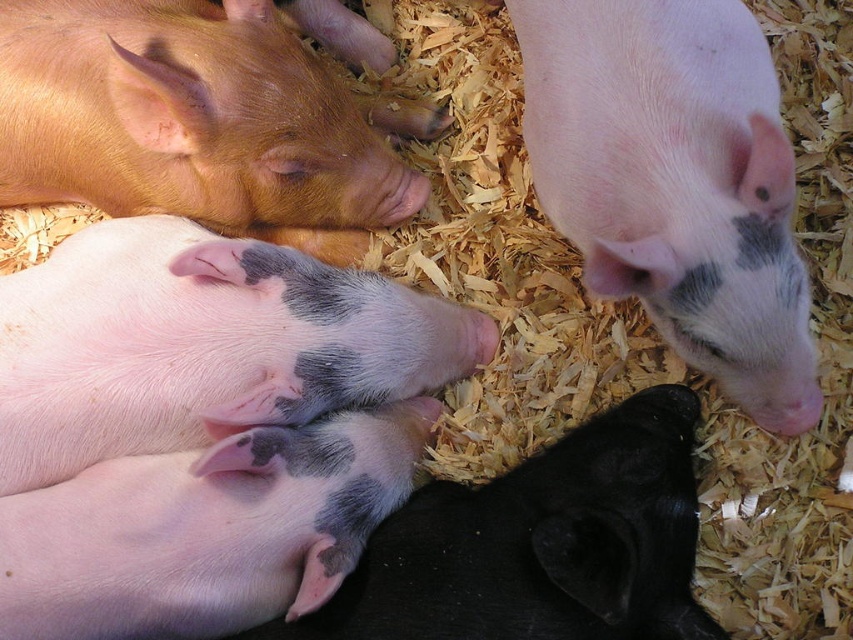
Can you confirm if matte orange piglet at upper left is thinner than speckled pink piglet at center?

No, matte orange piglet at upper left is not thinner than speckled pink piglet at center.

Is point (62, 1) closer to camera compared to point (396, 522)?

No, (62, 1) is further to viewer.

Locate an element on the screen. This screenshot has width=853, height=640. matte orange piglet at upper left is located at coordinates (190, 116).

What are the coordinates of `matte orange piglet at upper left` in the screenshot? It's located at (190, 116).

Is white matte piglet at upper right taller than speckled pink piglet at center?

Yes, white matte piglet at upper right is taller than speckled pink piglet at center.

Is point (596, 186) less distant than point (379, 605)?

No, (596, 186) is further to viewer.

Between point (763, 76) and point (531, 508), which one is positioned behind?

The point (763, 76) is behind.

I want to click on white matte piglet at upper right, so pyautogui.click(x=676, y=182).

Does point (149, 336) come farther from viewer compared to point (3, 42)?

No.

Which of these two, pink smooth piglet at center or matte orange piglet at upper left, stands taller?

pink smooth piglet at center

Between point (178, 442) and point (248, 209), which one is positioned in front?

Positioned in front is point (178, 442).

At what (x,y) coordinates should I click in order to perform the action: click on pink smooth piglet at center. Please return your answer as a coordinate pair (x, y). The width and height of the screenshot is (853, 640). Looking at the image, I should click on (201, 344).